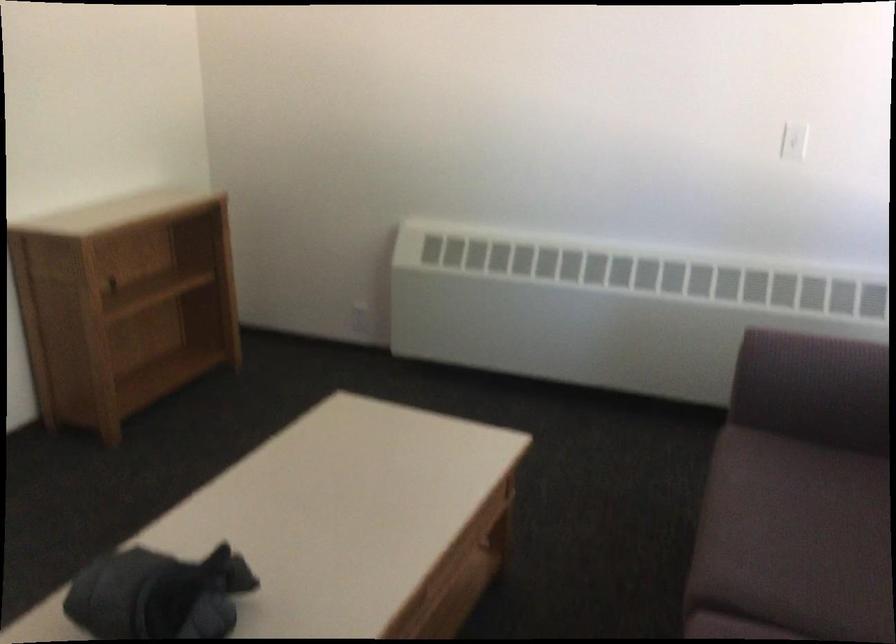
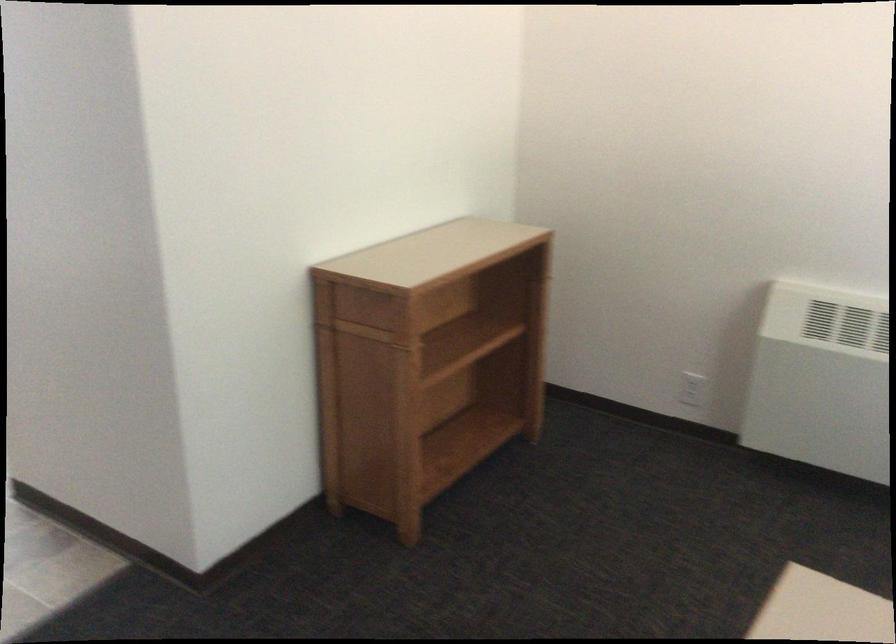
The point at [156,290] is marked in the first image. Where is the corresponding point in the second image?

(462, 345)